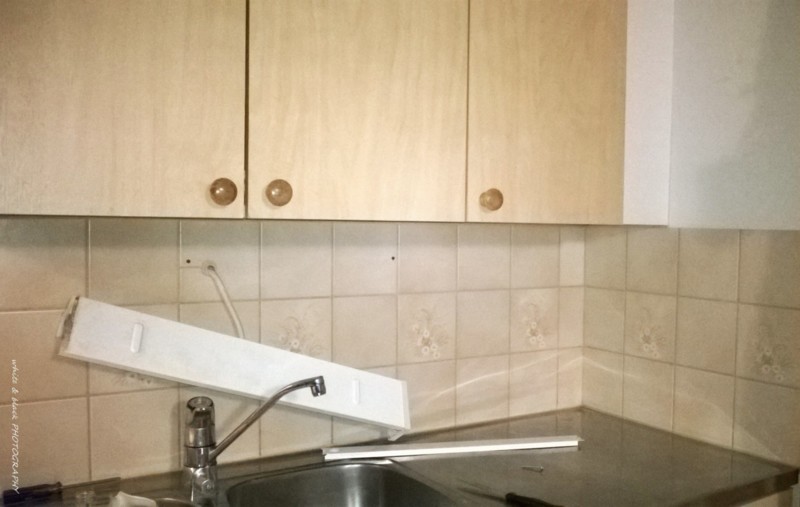
Locate an element on the screen. sink is located at coordinates (317, 490), (169, 502).